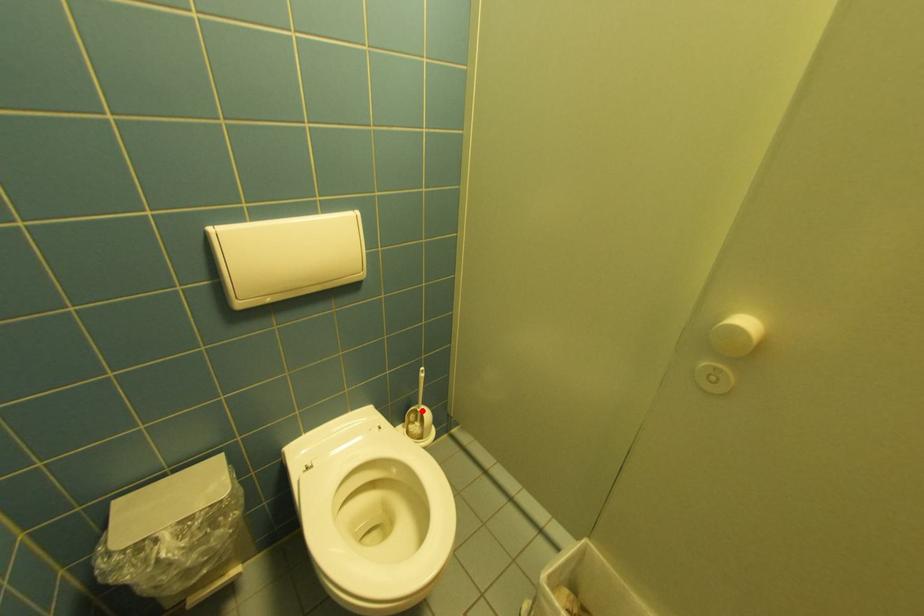
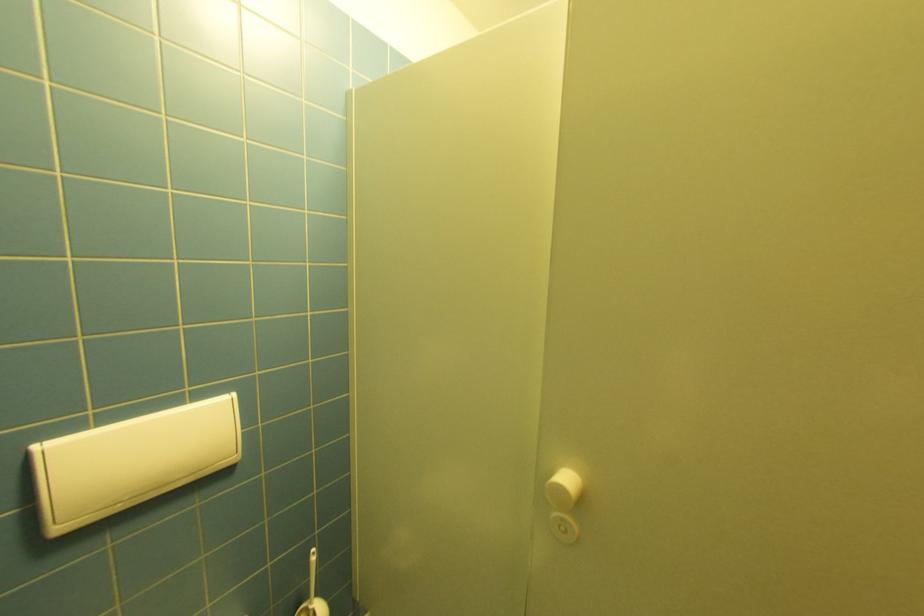
In the second image, find the point that corresponds to the highlighted location in the first image.

(312, 610)